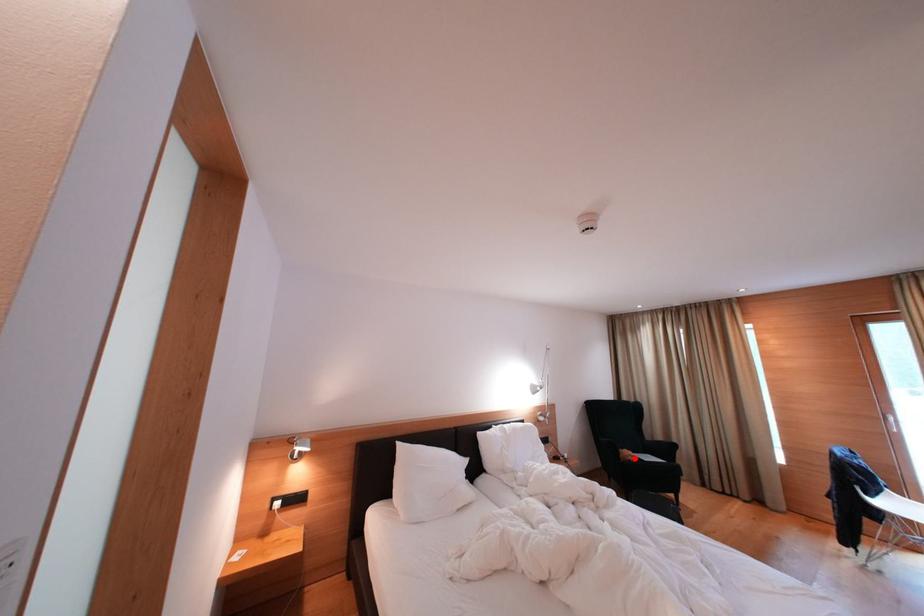
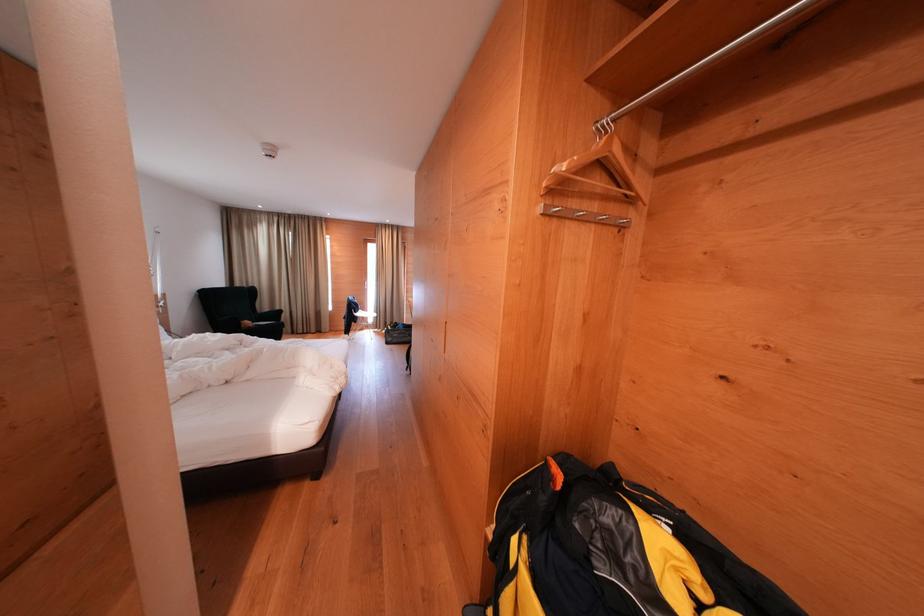
Question: I am providing you with two images of the same scene from different viewpoints. In image1, a red point is highlighted. Considering the same 3D point in image2, which of the following is correct?

Choices:
 (A) It is closer
 (B) It is farther

Answer: (A)